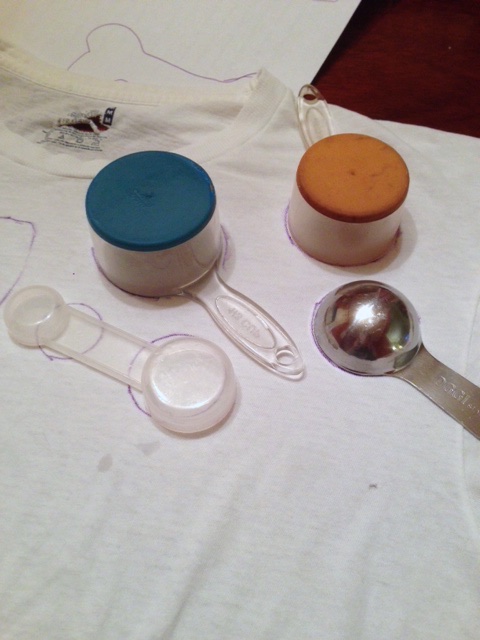
Where is `handle`? handle is located at coordinates (72, 347), (258, 337), (454, 390), (317, 121).